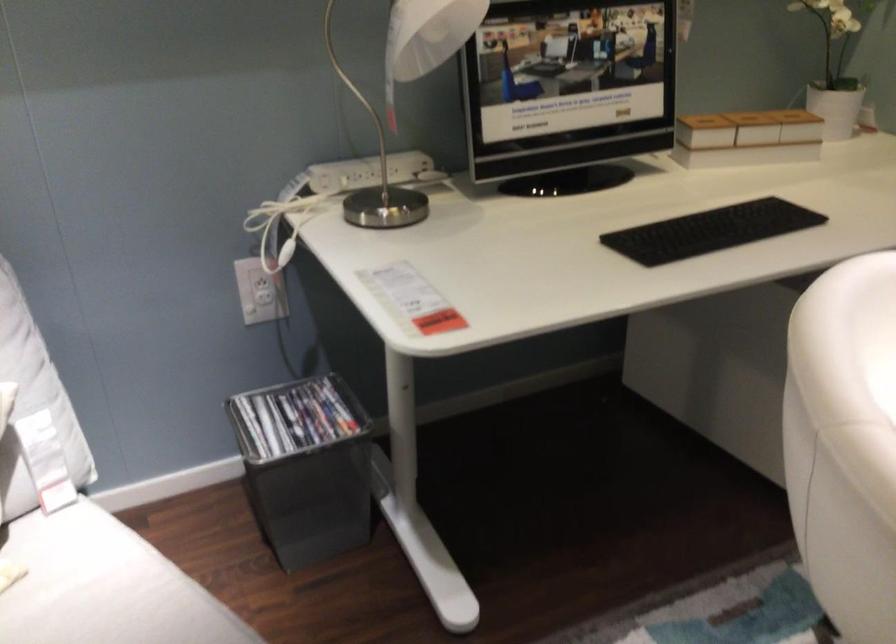
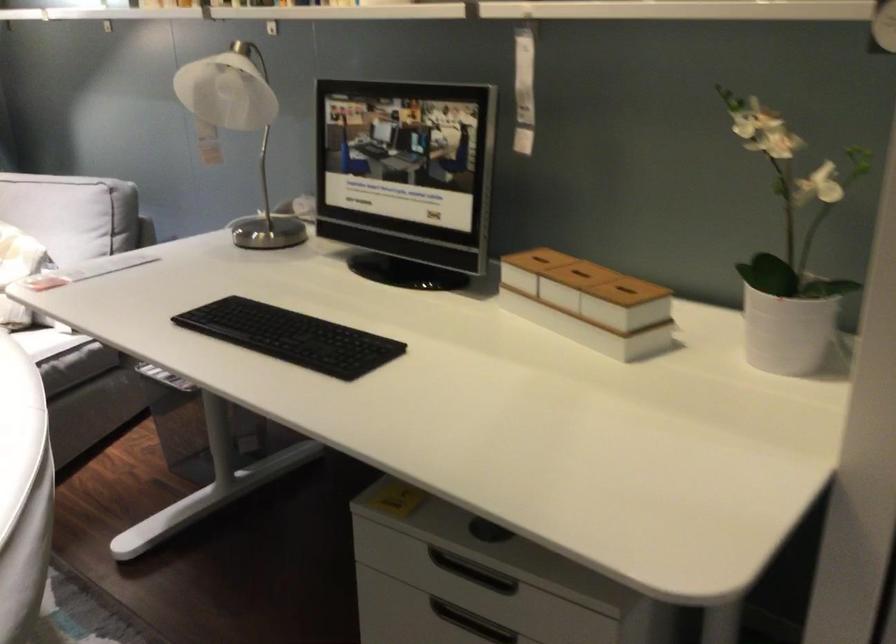
Find the pixel in the second image that matches point 743,228 in the first image.

(291, 337)